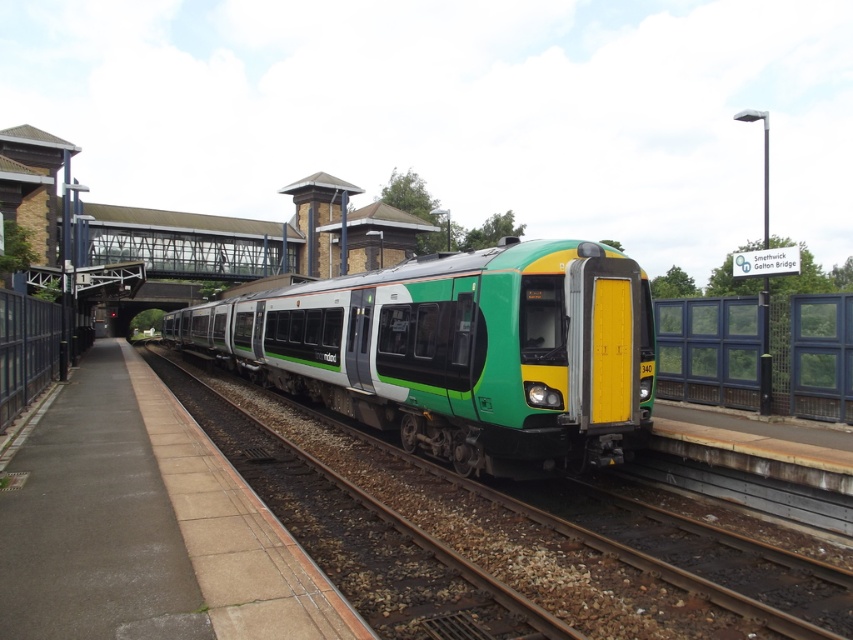
Based on the photo, is green matte train at center positioned behind green metallic train at center?

Yes.

Can you confirm if green matte train at center is positioned below green metallic train at center?

No.

Describe the element at coordinates (459, 352) in the screenshot. I see `green matte train at center` at that location.

You are a GUI agent. You are given a task and a screenshot of the screen. Output one action in this format:
    pyautogui.click(x=<x>, y=<y>)
    Task: Click on the green matte train at center
    
    Given the screenshot: What is the action you would take?
    pyautogui.click(x=459, y=352)